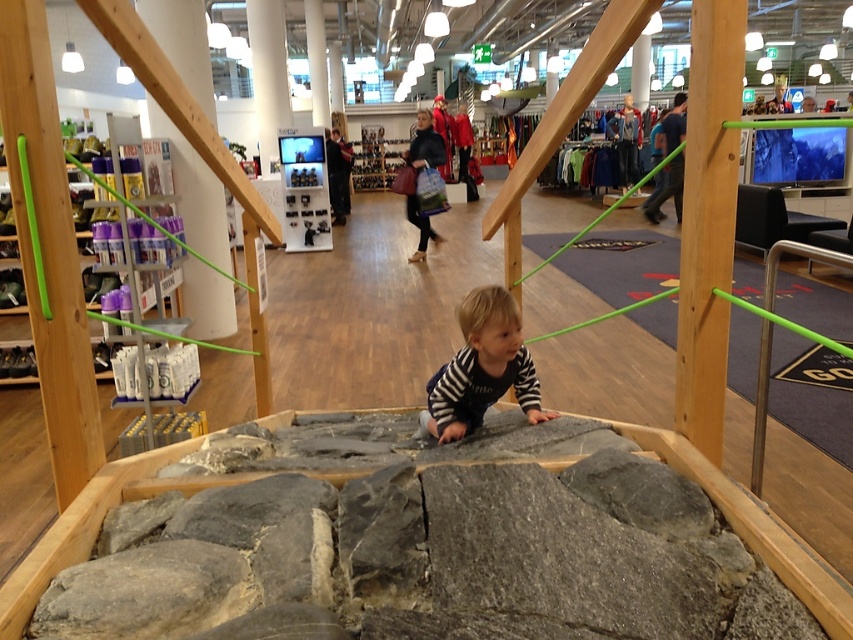
Which is above, wooden pole at right or striped cotton shirt at center?

wooden pole at right is higher up.

Does wooden pole at right have a lesser width compared to striped cotton shirt at center?

No, wooden pole at right is not thinner than striped cotton shirt at center.

Which is in front, point (688, 230) or point (486, 401)?

Point (688, 230) is in front.

Where is `wooden pole at right`? This screenshot has width=853, height=640. wooden pole at right is located at coordinates (708, 220).

Who is more forward, (738, 144) or (320, 220)?

Positioned in front is point (738, 144).

In the scene shown: How distant is wooden pole at right from metallic silver toy at upper center?

wooden pole at right is 7.39 meters away from metallic silver toy at upper center.

Locate an element on the screen. wooden pole at right is located at coordinates (708, 220).

Who is more forward, (479,328) or (303,212)?

Point (479,328)

Which of these two, striped cotton shirt at center or metallic silver toy at upper center, stands shorter?

Standing shorter between the two is striped cotton shirt at center.

Where is `striped cotton shirt at center`? The width and height of the screenshot is (853, 640). striped cotton shirt at center is located at coordinates (482, 368).